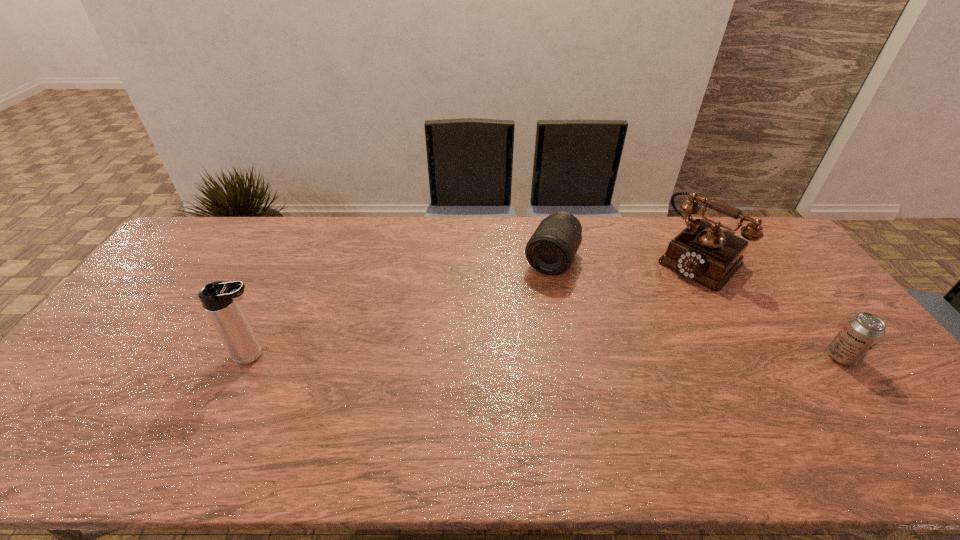
Locate an element on the screen. This screenshot has height=540, width=960. free space between the telephone and the beer can is located at coordinates (770, 308).

I want to click on vacant area that lies between the third object from left to right and the third object from right to left, so click(625, 259).

The height and width of the screenshot is (540, 960). In order to click on vacant area that lies between the beer can and the thermos bottle in this screenshot , I will do 548,356.

Where is `free space between the thermos bottle and the rightmost object`? The image size is (960, 540). free space between the thermos bottle and the rightmost object is located at coordinates (548, 356).

Where is `free space between the third object from right to left and the telephone`? The height and width of the screenshot is (540, 960). free space between the third object from right to left and the telephone is located at coordinates (625, 259).

The height and width of the screenshot is (540, 960). What are the coordinates of `vacant area that lies between the telephoto lens and the thermos bottle` in the screenshot? It's located at (403, 308).

Where is `free spot between the leftmost object and the telephoto lens`? This screenshot has width=960, height=540. free spot between the leftmost object and the telephoto lens is located at coordinates (403, 308).

This screenshot has width=960, height=540. Find the location of `unoccupied position between the beer can and the telephone`. unoccupied position between the beer can and the telephone is located at coordinates (770, 308).

I want to click on unoccupied position between the thermos bottle and the beer can, so (x=548, y=356).

This screenshot has width=960, height=540. Identify the location of unoccupied area between the telephoto lens and the rightmost object. (697, 308).